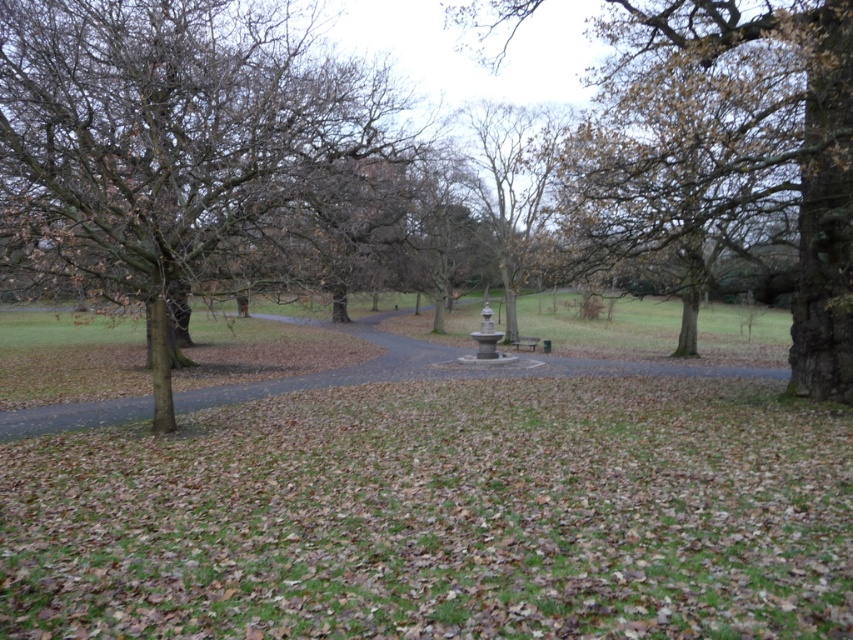
Consider the image. You are planning to place a picnic blanket on the wooden bench at center. Considering the size of the bench and the tree nearby, will the brown leafy tree at center block the sunlight reaching the bench by afternoon?

The brown leafy tree at center might be wider than the wooden bench at center, so it could potentially block sunlight from reaching the bench in the afternoon depending on the tree canopy spread.

You are standing at the entrance of the park and see the brown leafy tree at center and the smooth gray stone fountain at center. Which object is positioned to the left of the other?

The brown leafy tree at center is positioned to the left of the smooth gray stone fountain at center.